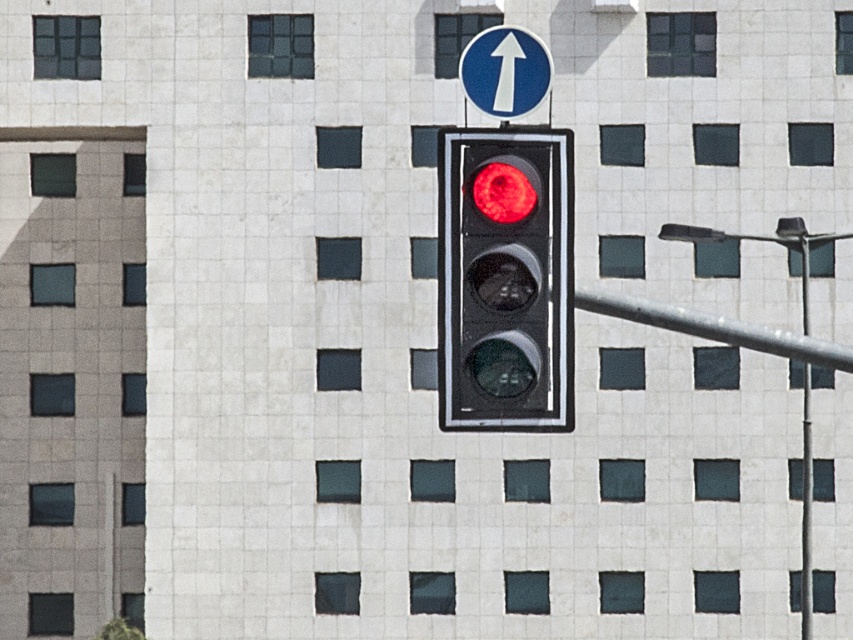
You are a pedestrian standing at the crosswalk and see the blue glossy sign at upper center and the metallic pole at right. Which object is higher up in the image?

The blue glossy sign at upper center is above the metallic pole at right, so it is higher up in the image.

You are standing at the traffic light and want to walk to the point that is closer to you. Which point should you go to, point [512,48] or point [805,630]?

Point [512,48] is in front of point [805,630], so you should go to point [512,48] since it is closer to you.

You are a pedestrian standing at the crosswalk and see the matte black traffic light at center and the metallic gray pole at right. Which object is positioned higher from the ground?

The matte black traffic light at center is above the metallic gray pole at right, so it is positioned higher from the ground.